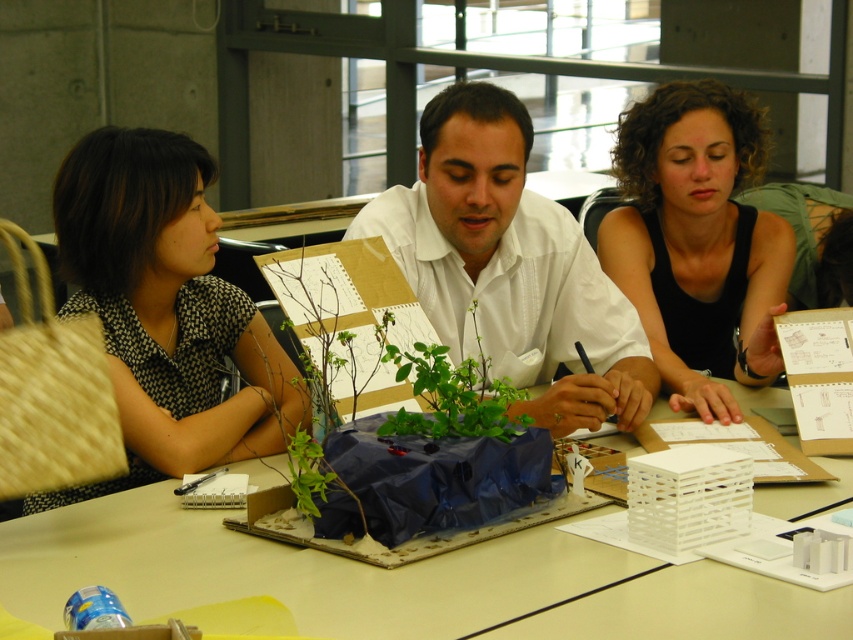
Which is behind, point (743, 388) or point (776, 310)?

Positioned behind is point (743, 388).

Between blue plastic bag at center and black matte tank top at upper right, which one is positioned lower?

Positioned lower is blue plastic bag at center.

Does point (65, 509) lie in front of point (601, 241)?

Yes.

Where is `blue plastic bag at center`? blue plastic bag at center is located at coordinates (393, 580).

Between point (180, 438) and point (733, 140), which one is positioned behind?

Positioned behind is point (733, 140).

Identify the location of black dotted dress at left. (165, 310).

Who is more distant from viewer, (254, 456) or (677, 144)?

The point (677, 144) is more distant.

Find the location of `black dotted dress at left`. black dotted dress at left is located at coordinates (165, 310).

Is black dotted dress at left shorter than white matte shirt at center?

No, black dotted dress at left is not shorter than white matte shirt at center.

Describe the element at coordinates (165, 310) in the screenshot. I see `black dotted dress at left` at that location.

Image resolution: width=853 pixels, height=640 pixels. Find the location of `black dotted dress at left`. black dotted dress at left is located at coordinates (165, 310).